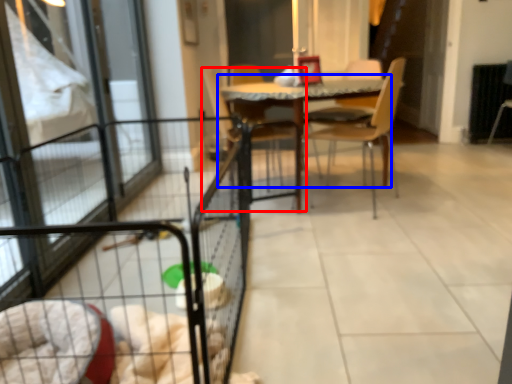
Question: Which object is closer to the camera taking this photo, chair (highlighted by a red box) or table (highlighted by a blue box)?

Choices:
 (A) chair
 (B) table

Answer: (B)